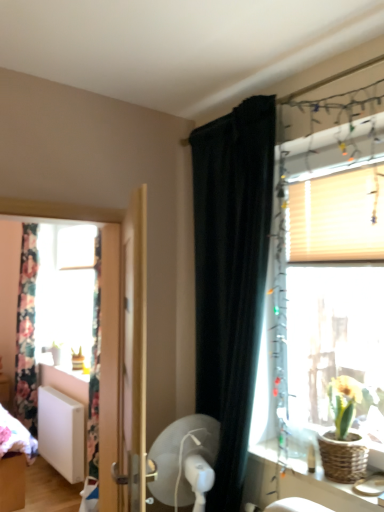
You are a GUI agent. You are given a task and a screenshot of the screen. Output one action in this format:
    pyautogui.click(x=<x>, y=<y>)
    Task: Click on the empty space that is ontop of white matte blind at upper right (from a real-world perspective)
    This screenshot has height=512, width=384.
    Given the screenshot: What is the action you would take?
    pyautogui.click(x=340, y=169)